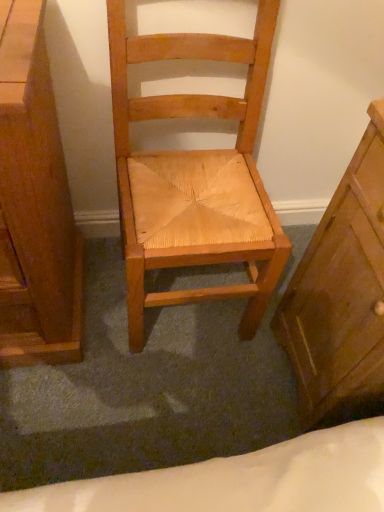
Question: From a real-world perspective, relative to natural wood chair at center, is wooden chest of drawers at left, which is the 1th chest of drawers from left to right, vertically above or below?

Choices:
 (A) below
 (B) above

Answer: (A)

Question: Does point (49, 179) appear closer or farther from the camera than point (162, 244)?

Choices:
 (A) farther
 (B) closer

Answer: (B)

Question: Which object is the closest to the wooden chest of drawers at right, which is the 1th chest of drawers from right to left?

Choices:
 (A) wooden chest of drawers at left, marked as the 2th chest of drawers in a right-to-left arrangement
 (B) natural wood chair at center

Answer: (B)

Question: Which object is positioned closest to the natural wood chair at center?

Choices:
 (A) wooden chest of drawers at right, which is the 1th chest of drawers from right to left
 (B) wooden chest of drawers at left, marked as the 2th chest of drawers in a right-to-left arrangement

Answer: (A)